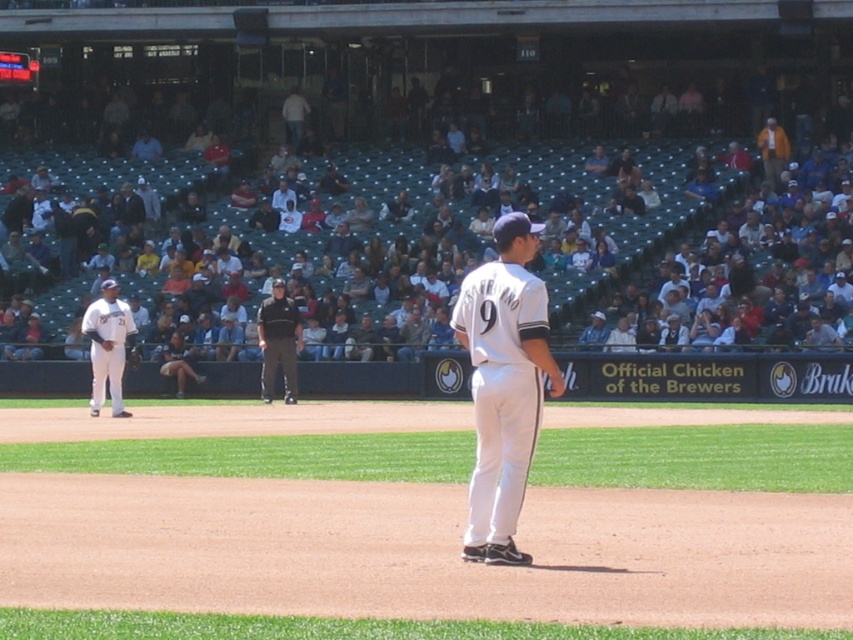
You are a photographer taking a picture of the baseball game. You want to focus on the two points marked in the image. Which point, point (428, 536) or point (758, 147), will appear larger in your photo?

Point (428, 536) will appear larger in the photo because it is closer to the viewer than point (758, 147).

You are a photographer standing at the edge of the field. You want to take a photo that includes both the white uniform pants at center and the light brown leather jacket at upper center. Given that your camera has a maximum zoom range of 50 feet, can you capture both subjects in the same frame without moving your position?

The white uniform pants at center and the light brown leather jacket at upper center are 66.76 feet apart. Since the camera can only zoom up to 50 feet, the distance between them exceeds the maximum zoom range. Therefore, you cannot capture both subjects in the same frame without moving your position.

You are a photographer standing at the edge of the baseball field. You want to take a photo of the orange cotton shirt at upper right without the white plastic seats at upper center blocking the view. Is there a way to adjust your position to achieve this?

The white plastic seats at upper center might be wider than orange cotton shirt at upper right, so there is a possibility that adjusting your position could allow you to frame the shot without obstruction. Move to the left or right to find an angle where the seats don